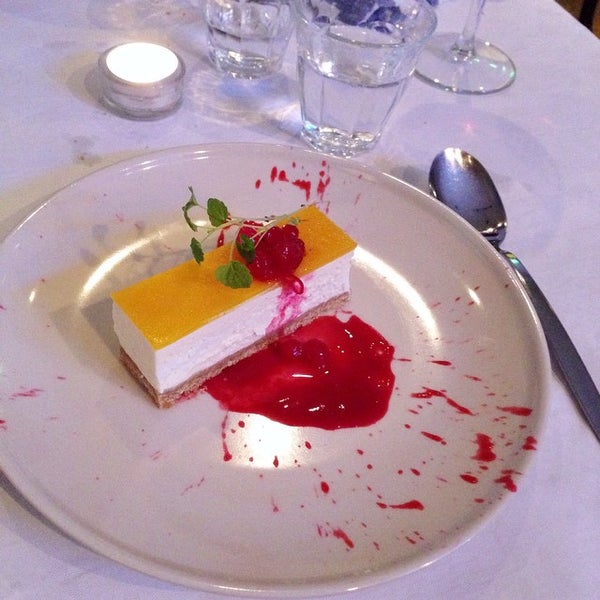
Identify the location of plate. The image size is (600, 600). [197, 515].